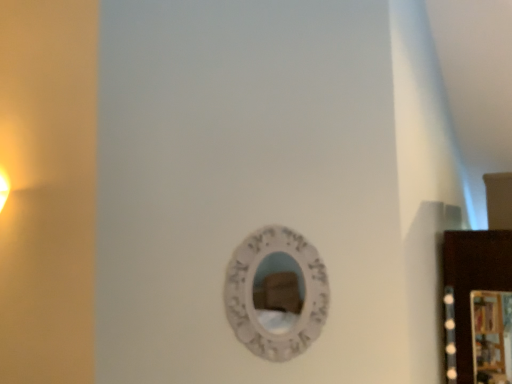
Question: From a real-world perspective, is wooden picture frame at right above or below white textured mirror at center?

Choices:
 (A) above
 (B) below

Answer: (B)

Question: Looking at the image, does wooden picture frame at right seem bigger or smaller compared to white textured mirror at center?

Choices:
 (A) small
 (B) big

Answer: (A)

Question: Is wooden picture frame at right inside the boundaries of white textured mirror at center, or outside?

Choices:
 (A) inside
 (B) outside

Answer: (B)

Question: Is white textured mirror at center bigger or smaller than wooden picture frame at right?

Choices:
 (A) small
 (B) big

Answer: (B)

Question: Considering the relative positions of white textured mirror at center and wooden picture frame at right in the image provided, is white textured mirror at center to the left or to the right of wooden picture frame at right?

Choices:
 (A) right
 (B) left

Answer: (B)

Question: From the image's perspective, is white textured mirror at center positioned above or below wooden picture frame at right?

Choices:
 (A) above
 (B) below

Answer: (A)

Question: Which is correct: white textured mirror at center is inside wooden picture frame at right, or outside of it?

Choices:
 (A) outside
 (B) inside

Answer: (A)